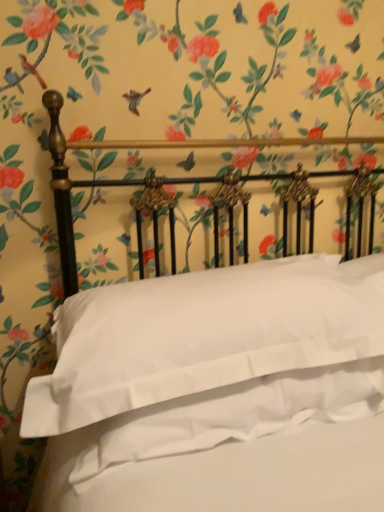
Question: Should I look upward or downward to see white satin sheet at center?

Choices:
 (A) up
 (B) down

Answer: (B)

Question: Is white smooth pillow at center directly adjacent to white satin sheet at center?

Choices:
 (A) no
 (B) yes

Answer: (A)

Question: Is white smooth pillow at center wider than white satin sheet at center?

Choices:
 (A) yes
 (B) no

Answer: (A)

Question: Does white smooth pillow at center have a larger size compared to white satin sheet at center?

Choices:
 (A) no
 (B) yes

Answer: (B)

Question: Is white smooth pillow at center to the right of white satin sheet at center from the viewer's perspective?

Choices:
 (A) yes
 (B) no

Answer: (B)

Question: From a real-world perspective, is white smooth pillow at center below white satin sheet at center?

Choices:
 (A) yes
 (B) no

Answer: (B)

Question: Is white smooth pillow at center shorter than white satin sheet at center?

Choices:
 (A) no
 (B) yes

Answer: (A)

Question: Is white satin sheet at center aimed at white smooth pillow at center?

Choices:
 (A) no
 (B) yes

Answer: (B)

Question: From a real-world perspective, does white satin sheet at center stand above white smooth pillow at center?

Choices:
 (A) yes
 (B) no

Answer: (B)

Question: Is white satin sheet at center oriented away from white smooth pillow at center?

Choices:
 (A) no
 (B) yes

Answer: (B)

Question: Considering the relative sizes of white satin sheet at center and white smooth pillow at center in the image provided, is white satin sheet at center shorter than white smooth pillow at center?

Choices:
 (A) yes
 (B) no

Answer: (A)

Question: Is white satin sheet at center smaller than white smooth pillow at center?

Choices:
 (A) no
 (B) yes

Answer: (B)

Question: Is white smooth pillow at center completely or partially inside white satin sheet at center?

Choices:
 (A) yes
 (B) no

Answer: (B)

Question: From the image's perspective, is white smooth pillow at center above or below white satin sheet at center?

Choices:
 (A) below
 (B) above

Answer: (B)